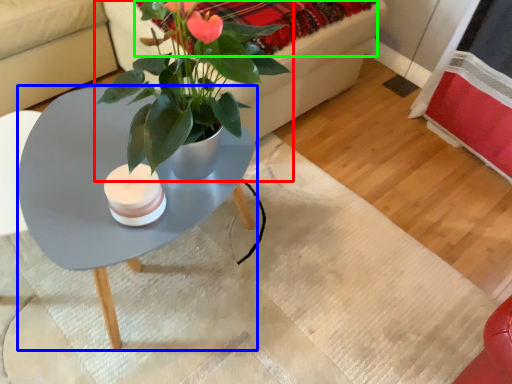
Question: Based on their relative distances, which object is farther from houseplant (highlighted by a red box)? Choose from coffee table (highlighted by a blue box) and blanket (highlighted by a green box).

Choices:
 (A) coffee table
 (B) blanket

Answer: (A)